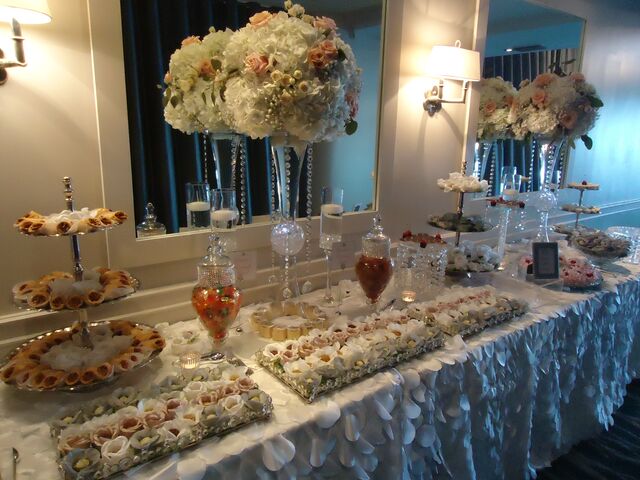
The width and height of the screenshot is (640, 480). What are the coordinates of `floor` in the screenshot? It's located at [584, 464].